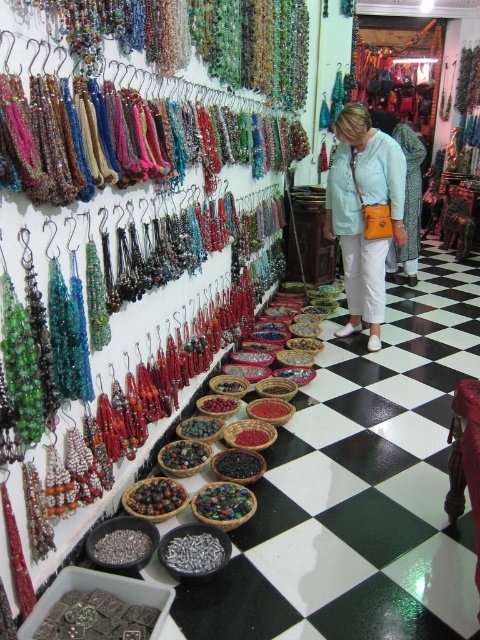
Question: Does light blue fabric shirt at center have a larger size compared to silver metallic bracelet at center?

Choices:
 (A) no
 (B) yes

Answer: (B)

Question: Does light blue fabric shirt at center appear under silver metallic bracelet at center?

Choices:
 (A) yes
 (B) no

Answer: (B)

Question: Can you confirm if light blue fabric shirt at center is bigger than silver metallic bracelet at center?

Choices:
 (A) yes
 (B) no

Answer: (A)